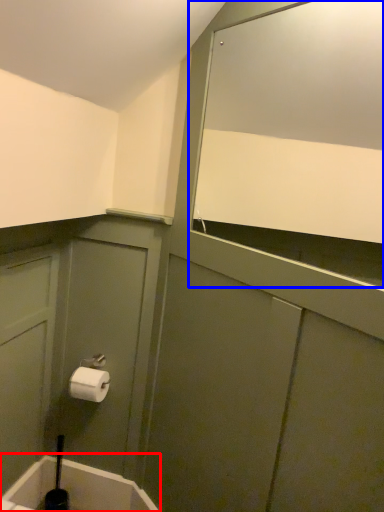
Question: Among these objects, which one is nearest to the camera, bath (highlighted by a red box) or mirror (highlighted by a blue box)?

Choices:
 (A) bath
 (B) mirror

Answer: (B)